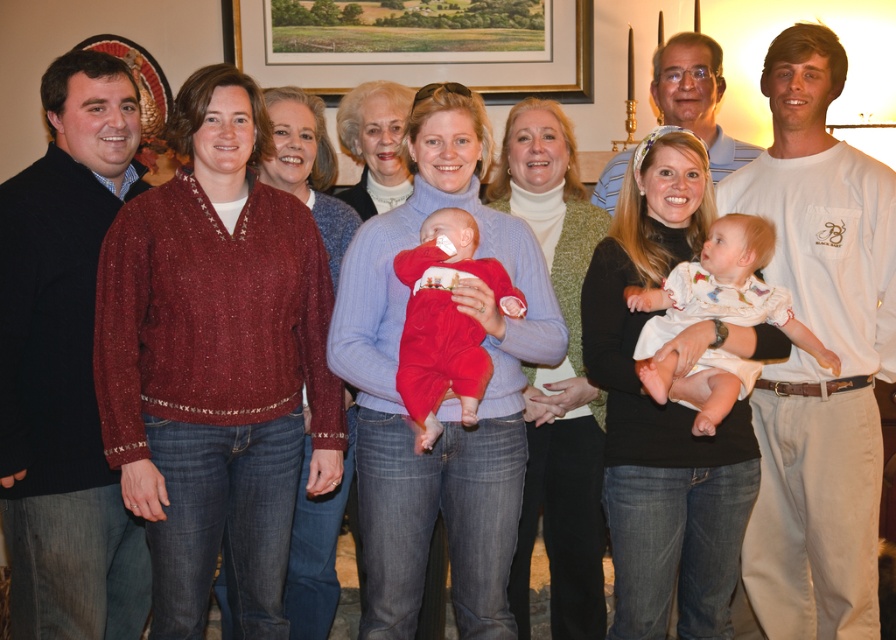
Question: Which point is farther to the camera?

Choices:
 (A) (341, 10)
 (B) (817, 362)
 (C) (418, 337)

Answer: (A)

Question: Can you confirm if matte red sweater at center is thinner than white lace dress at center?

Choices:
 (A) no
 (B) yes

Answer: (A)

Question: Where is matte red sweater at center located in relation to wooden picture frame at upper center in the image?

Choices:
 (A) right
 (B) left

Answer: (A)

Question: Which point is closer to the camera?

Choices:
 (A) (372, 304)
 (B) (261, 42)
 (C) (428, 348)
 (D) (724, 353)

Answer: (C)

Question: Among these objects, which one is farthest from the camera?

Choices:
 (A) red fleece onesie at center
 (B) matte red sweater at center

Answer: (B)

Question: Is wooden picture frame at upper center in front of white lace dress at center?

Choices:
 (A) yes
 (B) no

Answer: (B)